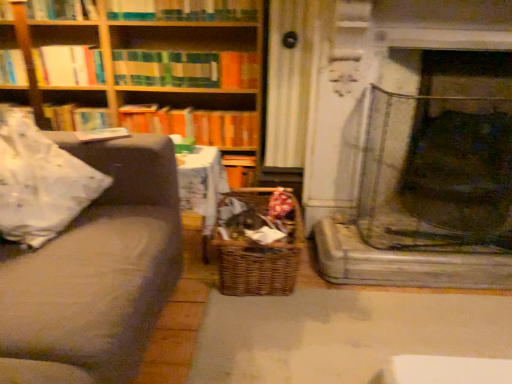
Question: Is hardcover book at upper left, positioned as the 2th book in bottom-to-top order, wider than woodenmaterial/texturebookcase at upper left?

Choices:
 (A) no
 (B) yes

Answer: (A)

Question: Is hardcover book at upper left, positioned as the 2th book in bottom-to-top order, aimed at woodenmaterial/texturebookcase at upper left?

Choices:
 (A) no
 (B) yes

Answer: (B)

Question: From a real-world perspective, is hardcover book at upper left, positioned as the fourth book in top-to-bottom order, physically below woodenmaterial/texturebookcase at upper left?

Choices:
 (A) no
 (B) yes

Answer: (B)

Question: Is hardcover book at upper left, positioned as the 2th book in bottom-to-top order, turned away from woodenmaterial/texturebookcase at upper left?

Choices:
 (A) no
 (B) yes

Answer: (B)

Question: Can woodenmaterial/texturebookcase at upper left be found inside hardcover book at upper left, positioned as the fourth book in top-to-bottom order?

Choices:
 (A) no
 (B) yes

Answer: (A)

Question: Looking at their shapes, would you say orange matte book at center, the 5th book in the top-to-bottom sequence, is wider or thinner than striped fabric book at upper center, arranged as the 3th book when ordered from the bottom?

Choices:
 (A) thin
 (B) wide

Answer: (B)

Question: Relative to striped fabric book at upper center, the third book when ordered from top to bottom, is orange matte book at center, acting as the 1th book starting from the bottom, in front or behind?

Choices:
 (A) front
 (B) behind

Answer: (B)

Question: Which is correct: orange matte book at center, the 5th book in the top-to-bottom sequence, is inside striped fabric book at upper center, arranged as the 3th book when ordered from the bottom, or outside of it?

Choices:
 (A) inside
 (B) outside

Answer: (B)

Question: Is orange matte book at center, the 5th book in the top-to-bottom sequence, bigger or smaller than striped fabric book at upper center, arranged as the 3th book when ordered from the bottom?

Choices:
 (A) big
 (B) small

Answer: (A)

Question: Would you say hardcover book at upper left, positioned as the 2th book in bottom-to-top order, is to the left or to the right of woven brown basket at center in the picture?

Choices:
 (A) left
 (B) right

Answer: (A)

Question: From the image's perspective, is hardcover book at upper left, positioned as the fourth book in top-to-bottom order, positioned above or below woven brown basket at center?

Choices:
 (A) above
 (B) below

Answer: (A)

Question: From a real-world perspective, is hardcover book at upper left, positioned as the fourth book in top-to-bottom order, positioned above or below woven brown basket at center?

Choices:
 (A) below
 (B) above

Answer: (B)

Question: Is hardcover book at upper left, positioned as the fourth book in top-to-bottom order, wider or thinner than woven brown basket at center?

Choices:
 (A) wide
 (B) thin

Answer: (B)

Question: In the image, is wooden bookshelf at upper left on the left side or the right side of woven brown basket at center?

Choices:
 (A) left
 (B) right

Answer: (A)

Question: Is point (101, 61) positioned closer to the camera than point (259, 288)?

Choices:
 (A) farther
 (B) closer

Answer: (A)